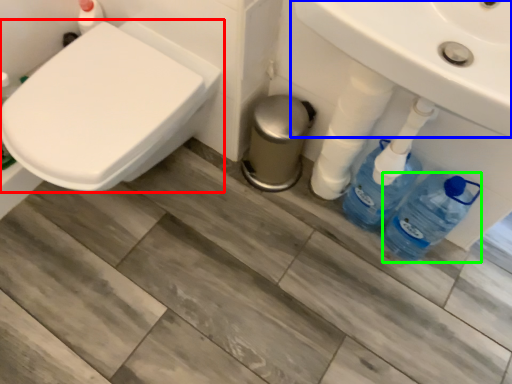
Question: Based on their relative distances, which object is farther from toilet (highlighted by a red box)? Choose from sink (highlighted by a blue box) and bottle (highlighted by a green box).

Choices:
 (A) sink
 (B) bottle

Answer: (B)